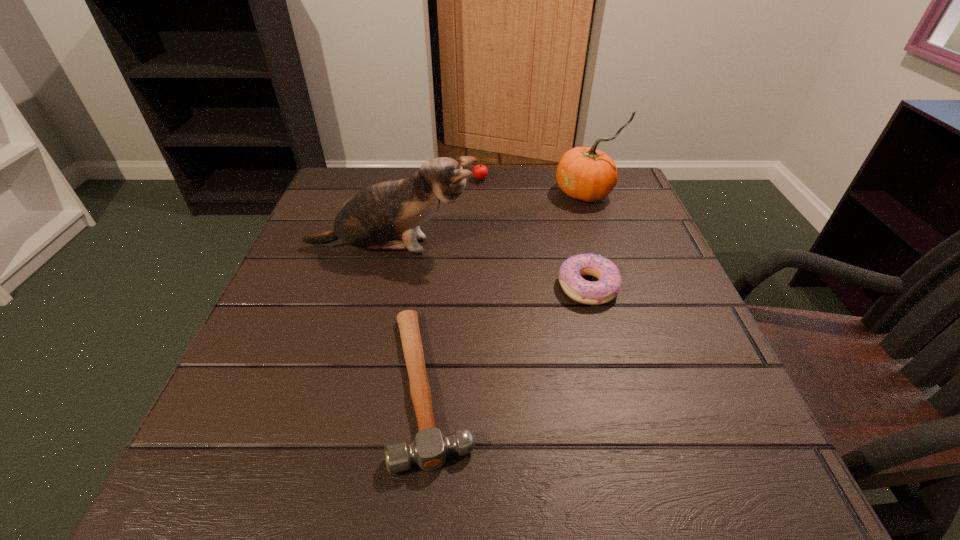
Identify the location of vacant space that is in between the third farthest object and the doughnut. The image size is (960, 540). (490, 267).

The width and height of the screenshot is (960, 540). Identify the location of free space between the third tallest object and the third nearest object. point(437,213).

The width and height of the screenshot is (960, 540). I want to click on unoccupied area between the doughnut and the cherry, so click(535, 233).

Find the location of a particular element. The width and height of the screenshot is (960, 540). object identified as the fourth closest to the nearest object is located at coordinates (480, 171).

Select which object appears as the closest to the second shortest object. Please provide its 2D coordinates. Your answer should be formatted as a tuple, i.e. [(x, y)], where the tuple contains the x and y coordinates of a point satisfying the conditions above.

[(387, 215)]

Find the location of a particular element. The height and width of the screenshot is (540, 960). free location that satisfies the following two spatial constraints: 1. at the face of the nearest object; 2. on the left side of the cat is located at coordinates (357, 386).

Where is `vacant space that satisfies the following two spatial constraints: 1. at the face of the third nearest object; 2. on the back side of the hammer`? vacant space that satisfies the following two spatial constraints: 1. at the face of the third nearest object; 2. on the back side of the hammer is located at coordinates (357, 386).

Identify the location of vacant point that satisfies the following two spatial constraints: 1. at the face of the cat; 2. on the left side of the second nearest object. This screenshot has width=960, height=540. [x=381, y=287].